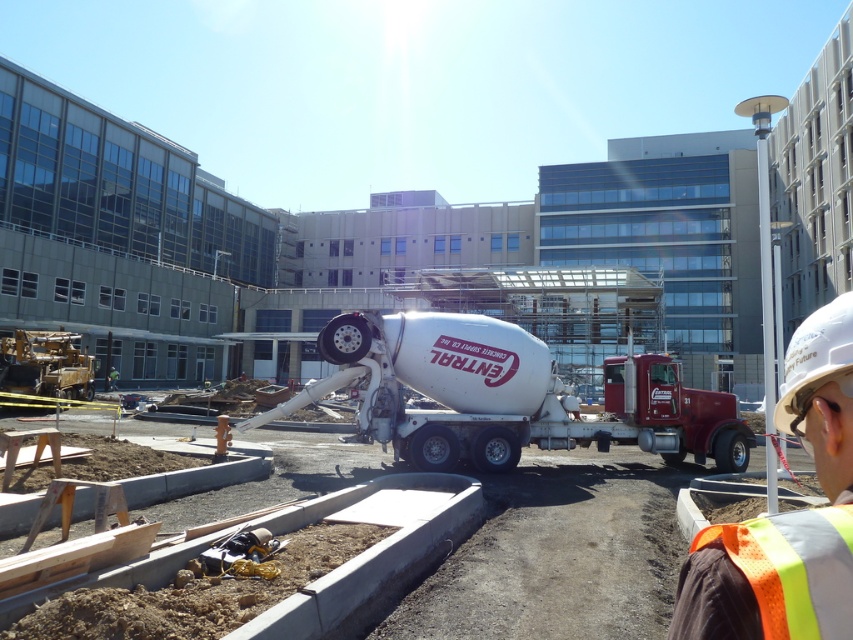
Question: Does white metallic concrete mixer at center have a greater width compared to hi-visibility reflective safety vest at lower right?

Choices:
 (A) yes
 (B) no

Answer: (A)

Question: Which object is the closest to the white hard hat at upper right?

Choices:
 (A) white metallic concrete mixer at center
 (B) hi-visibility reflective safety vest at lower right

Answer: (B)

Question: From the image, what is the correct spatial relationship of white metallic concrete mixer at center in relation to orange reflective vest at lower right?

Choices:
 (A) above
 (B) below

Answer: (B)

Question: Which point is closer to the camera?

Choices:
 (A) orange reflective vest at lower right
 (B) white hard hat at upper right
 (C) hi-visibility reflective safety vest at lower right

Answer: (C)

Question: Does orange reflective vest at lower right come in front of white hard hat at upper right?

Choices:
 (A) no
 (B) yes

Answer: (B)

Question: Estimate the real-world distances between objects in this image. Which object is closer to the orange reflective vest at lower right?

Choices:
 (A) hi-visibility reflective safety vest at lower right
 (B) white hard hat at upper right
 (C) white metallic concrete mixer at center

Answer: (A)